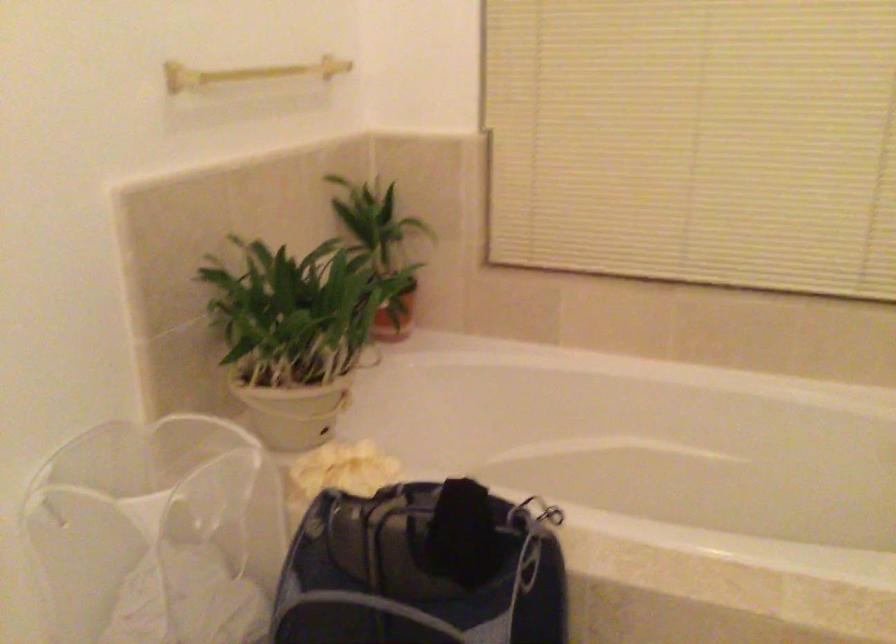
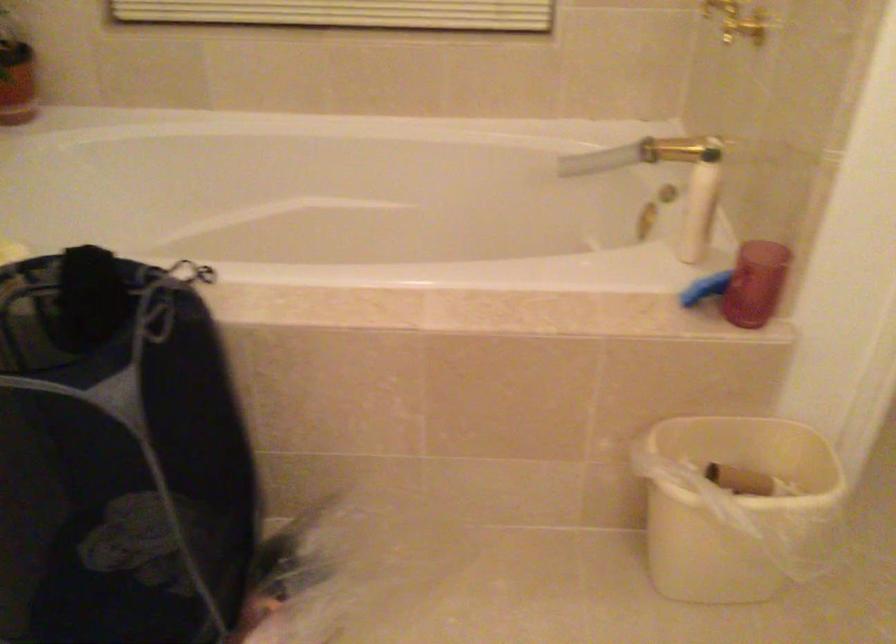
Question: What movement of the cameraman would produce the second image?

Choices:
 (A) Left
 (B) Right
 (C) Forward
 (D) Backward

Answer: (B)